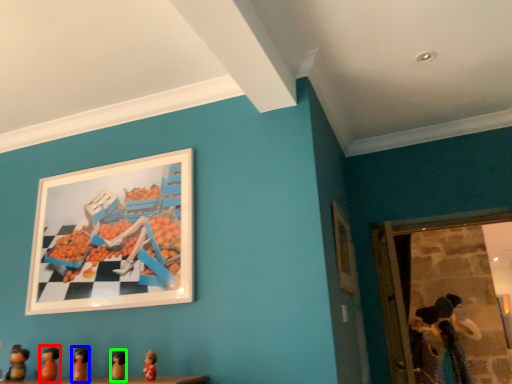
Question: Estimate the real-world distances between objects in this image. Which object is farther from toy (highlighted by a red box), toy (highlighted by a blue box) or toy (highlighted by a green box)?

Choices:
 (A) toy
 (B) toy

Answer: (B)